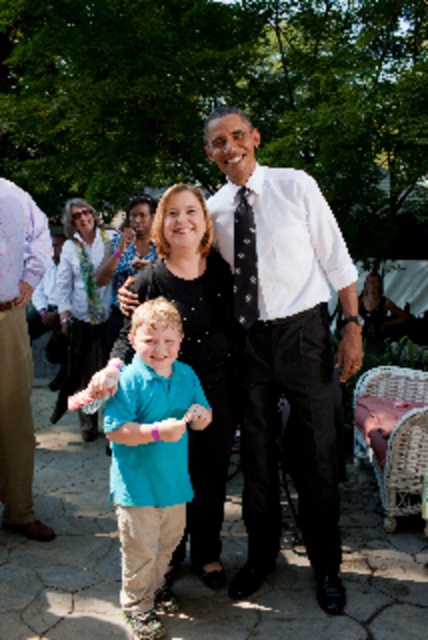
Consider the image. Does white textured shirt at center appear over teal cotton shirt at center?

Indeed, white textured shirt at center is positioned over teal cotton shirt at center.

Does white textured shirt at center have a lesser width compared to teal cotton shirt at center?

In fact, white textured shirt at center might be wider than teal cotton shirt at center.

Is point (252, 147) positioned behind point (127, 518)?

Yes, point (252, 147) is behind point (127, 518).

In order to click on white textured shirt at center in this screenshot , I will do `click(287, 352)`.

Who is lower down, light purple fabric at left or white shirt at center?

white shirt at center is lower down.

Is point (29, 458) in front of point (281, 317)?

No.

This screenshot has width=428, height=640. What do you see at coordinates (18, 353) in the screenshot?
I see `light purple fabric at left` at bounding box center [18, 353].

The height and width of the screenshot is (640, 428). Find the location of `light purple fabric at left`. light purple fabric at left is located at coordinates (18, 353).

Who is shorter, white textured shirt at center or white shirt at center?

Standing shorter between the two is white shirt at center.

Who is more distant from viewer, [309,349] or [279,625]?

Point [309,349]

What do you see at coordinates (287, 352) in the screenshot? I see `white textured shirt at center` at bounding box center [287, 352].

Image resolution: width=428 pixels, height=640 pixels. Find the location of `white textured shirt at center`. white textured shirt at center is located at coordinates (287, 352).